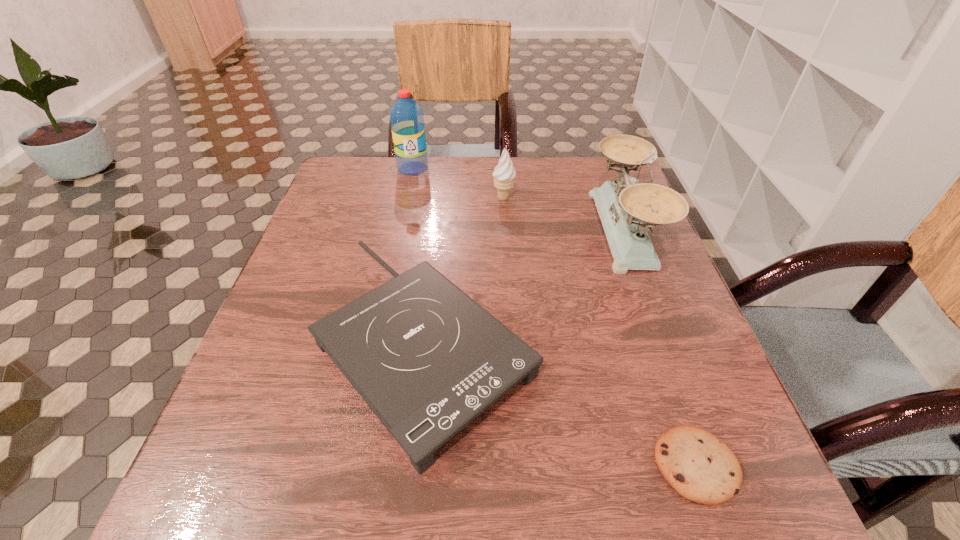
This screenshot has width=960, height=540. I want to click on blank space located 0.340m on the front-facing side of the third tallest object, so click(x=362, y=198).

This screenshot has height=540, width=960. What are the coordinates of `blank area located on the front-facing side of the third tallest object` in the screenshot? It's located at (393, 198).

What are the coordinates of `free space located on the right of the hotplate` in the screenshot? It's located at (687, 342).

The image size is (960, 540). I want to click on vacant area situated on the left of the cookie, so click(581, 465).

Identify the location of water bottle present at the far edge. Image resolution: width=960 pixels, height=540 pixels. (406, 116).

Identify the location of scale that is at the far edge. This screenshot has height=540, width=960. (627, 211).

Locate an element on the screen. icecream positioned at the far edge is located at coordinates (504, 173).

Identify the location of hotplate located at the near edge. The width and height of the screenshot is (960, 540). (427, 359).

Find the location of `cookie present at the near edge`. cookie present at the near edge is located at coordinates (701, 468).

The image size is (960, 540). I want to click on object at the left edge, so tap(427, 359).